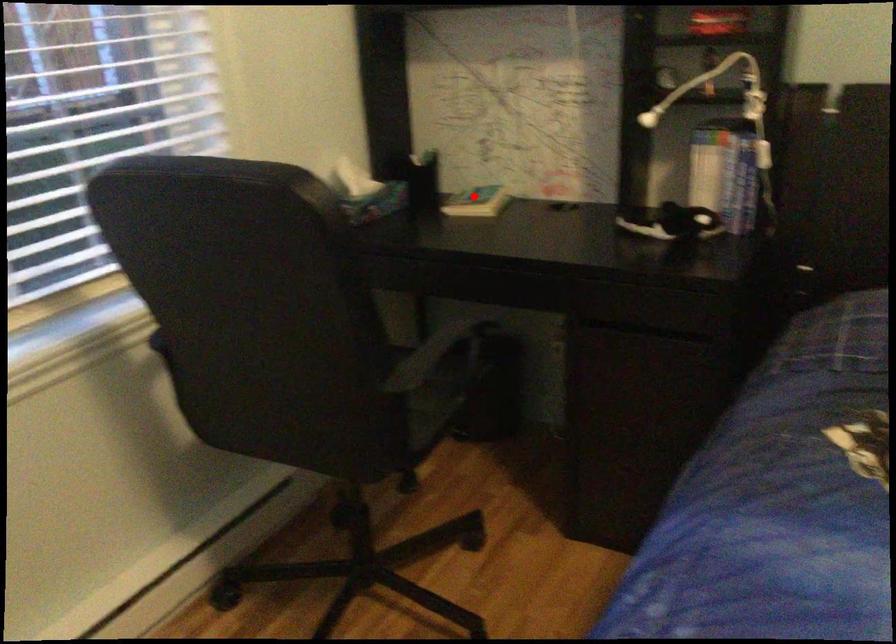
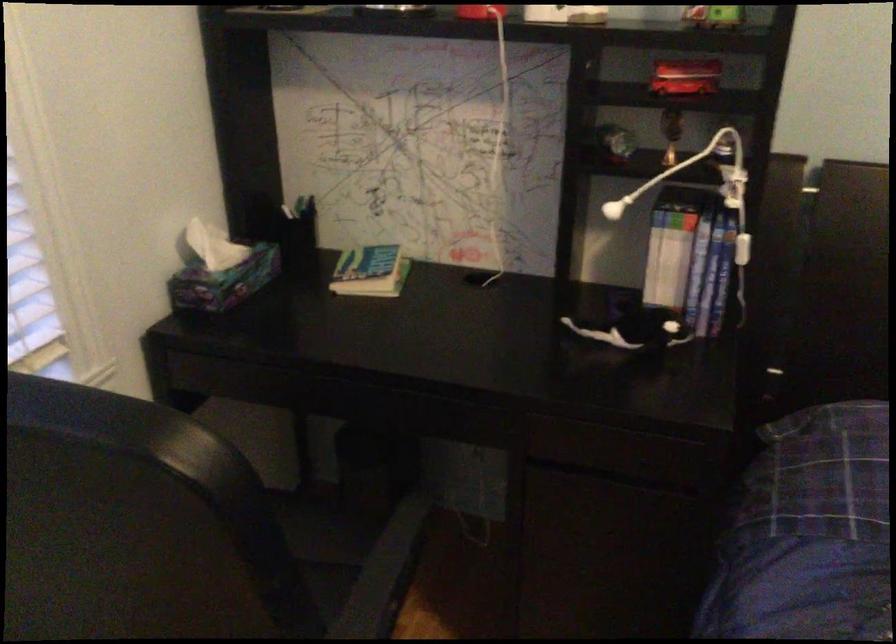
Question: A red point is marked in image1. In image2, is the corresponding 3D point closer to the camera or farther? Reply with the corresponding letter.

Choices:
 (A) The corresponding 3D point is closer.
 (B) The corresponding 3D point is farther.

Answer: (A)